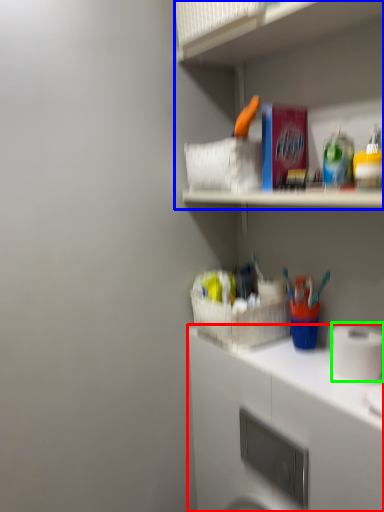
Question: Considering the real-world distances, which object is closest to cabinetry (highlighted by a red box)? shelf (highlighted by a blue box) or toilet paper (highlighted by a green box).

Choices:
 (A) shelf
 (B) toilet paper

Answer: (B)